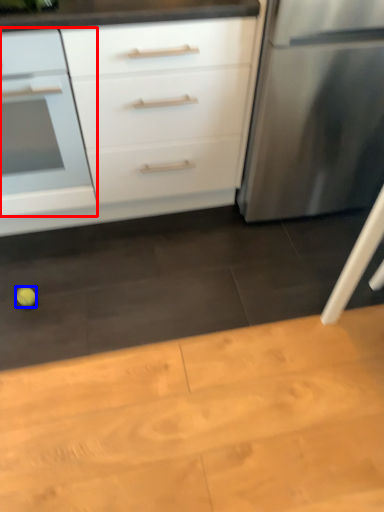
Question: Which object appears farthest to the camera in this image, drawer (highlighted by a red box) or lime (highlighted by a blue box)?

Choices:
 (A) drawer
 (B) lime

Answer: (B)